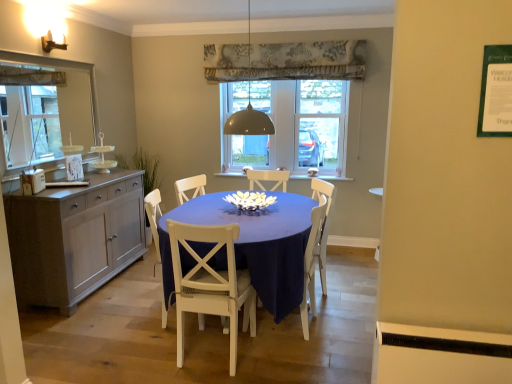
Question: Are matte gray dome at center and white wood chair at center, which is the 3th chair in left-to-right order, beside each other?

Choices:
 (A) yes
 (B) no

Answer: (B)

Question: From a real-world perspective, is matte gray dome at center located beneath white wood chair at center, positioned as the 1th chair in right-to-left order?

Choices:
 (A) yes
 (B) no

Answer: (B)

Question: From a real-world perspective, does matte gray dome at center stand above white wood chair at center, which is the 3th chair in left-to-right order?

Choices:
 (A) no
 (B) yes

Answer: (B)

Question: Considering the relative sizes of matte gray dome at center and white wood chair at center, positioned as the 1th chair in right-to-left order, in the image provided, is matte gray dome at center smaller than white wood chair at center, positioned as the 1th chair in right-to-left order,?

Choices:
 (A) no
 (B) yes

Answer: (B)

Question: Is the position of matte gray dome at center more distant than that of white wood chair at center, which is the 3th chair in left-to-right order?

Choices:
 (A) no
 (B) yes

Answer: (B)

Question: Considering the relative positions of matte gray dome at center and white wood chair at center, positioned as the 1th chair in right-to-left order, in the image provided, is matte gray dome at center in front of white wood chair at center, positioned as the 1th chair in right-to-left order,?

Choices:
 (A) yes
 (B) no

Answer: (B)

Question: Could you tell me if matte gray dome at center is facing matte gray cabinet at left?

Choices:
 (A) yes
 (B) no

Answer: (B)

Question: Is matte gray dome at center to the right of matte gray cabinet at left from the viewer's perspective?

Choices:
 (A) no
 (B) yes

Answer: (B)

Question: Can you confirm if matte gray dome at center is wider than matte gray cabinet at left?

Choices:
 (A) yes
 (B) no

Answer: (B)

Question: Would you say matte gray dome at center contains matte gray cabinet at left?

Choices:
 (A) no
 (B) yes

Answer: (A)

Question: Is matte gray dome at center outside matte gray cabinet at left?

Choices:
 (A) yes
 (B) no

Answer: (A)

Question: From a real-world perspective, is matte gray dome at center located higher than matte gray cabinet at left?

Choices:
 (A) no
 (B) yes

Answer: (B)

Question: Is matte gray dome at center not within white wood chair at center, arranged as the 2th chair when viewed from the right?

Choices:
 (A) yes
 (B) no

Answer: (A)